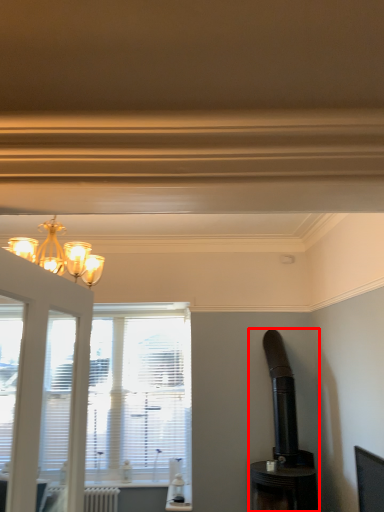
Question: From the image's perspective, what is the correct spatial positioning of appliance (annotated by the red box) in reference to radiator?

Choices:
 (A) below
 (B) above

Answer: (B)